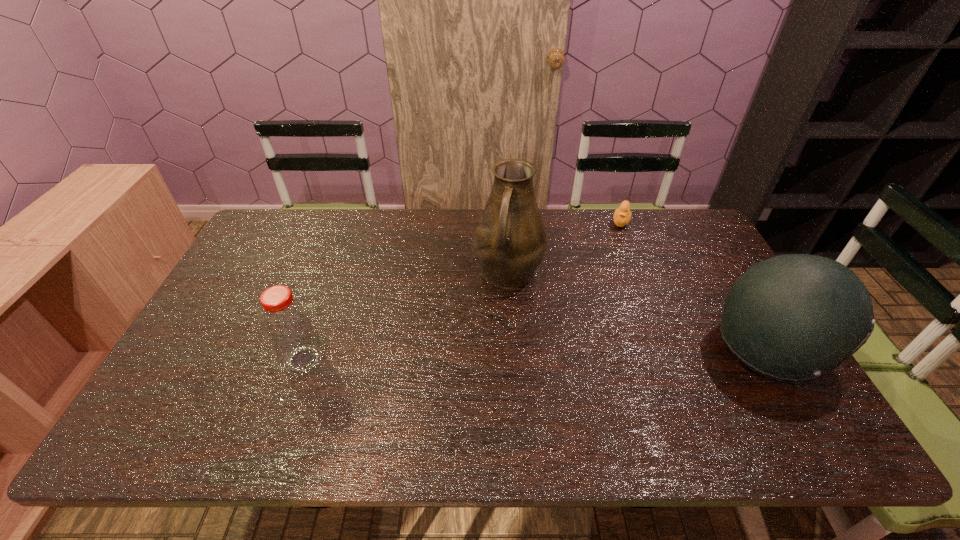
Identify the location of vacant space on the desktop that is between the bottle and the third shortest object and is positioned on the face of the third object from left to right. The width and height of the screenshot is (960, 540). (579, 354).

The width and height of the screenshot is (960, 540). In order to click on vacant spot on the desktop that is between the bottle and the football helmet and is positioned on the handle side of the pitcher in this screenshot , I will do `click(484, 356)`.